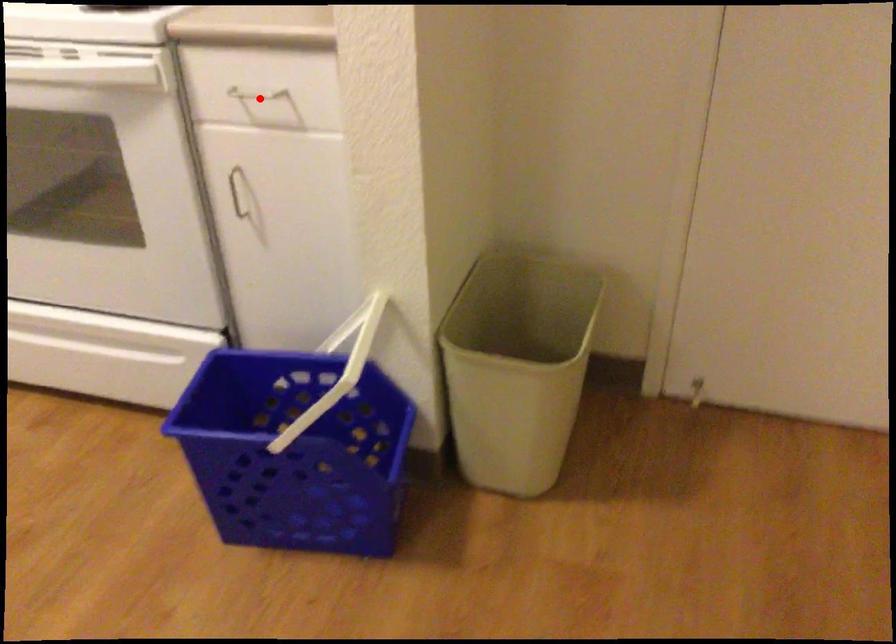
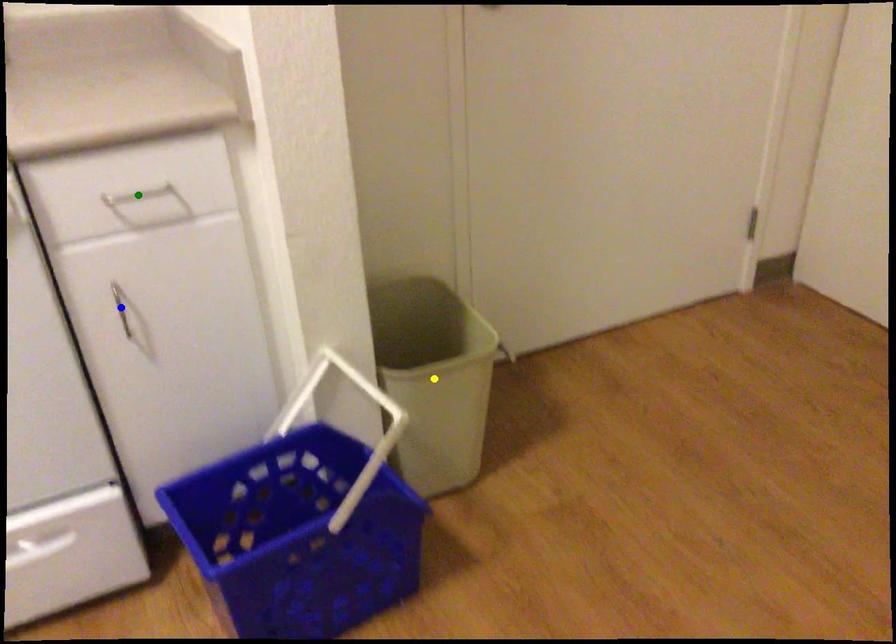
Question: I am providing you with two images of the same scene from different viewpoints. A red point is marked on the first image. You are given multiple points on the second image. In image 2, which mark is for the same physical point as the one in image 1?

Choices:
 (A) green point
 (B) blue point
 (C) yellow point

Answer: (A)